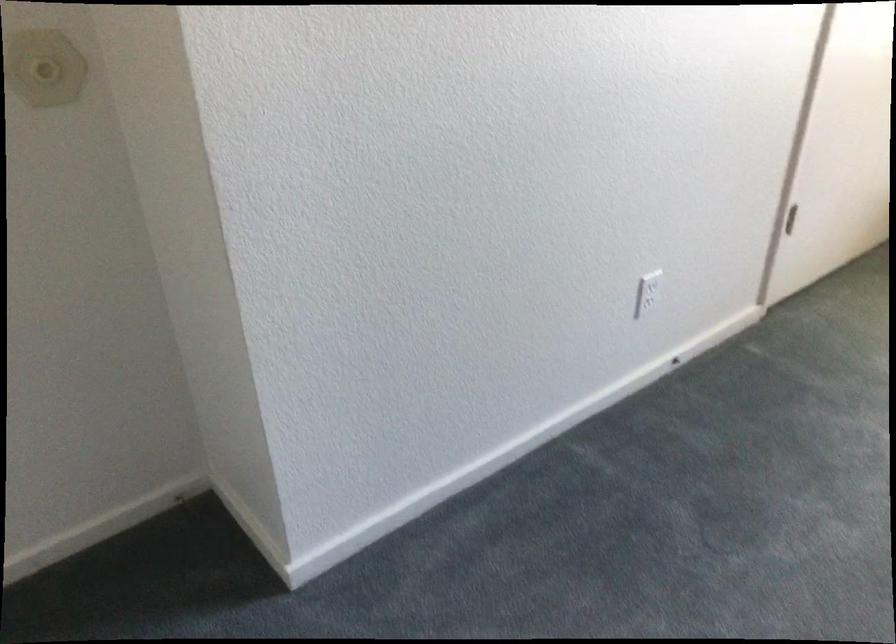
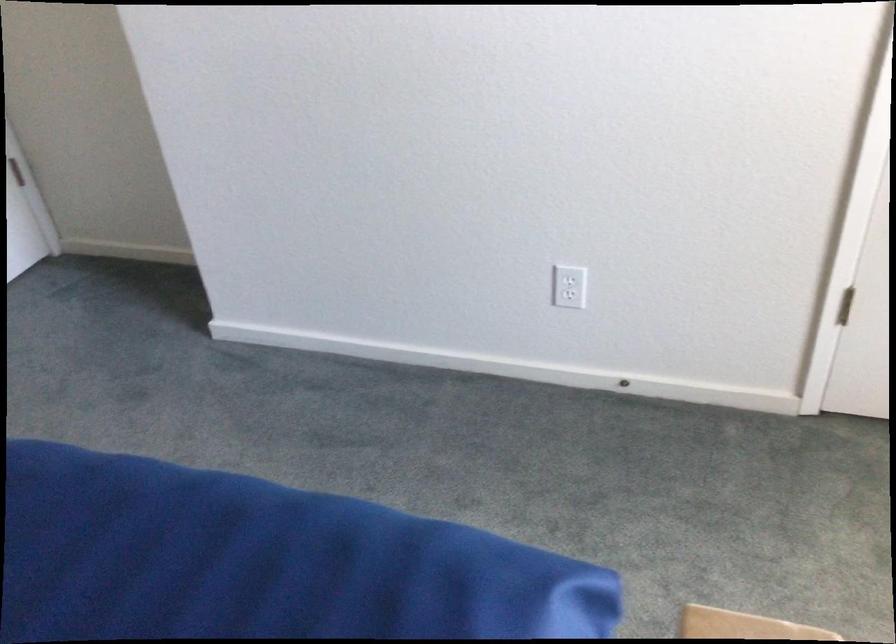
Locate, in the second image, the point that corresponds to (668,362) in the first image.

(624, 384)